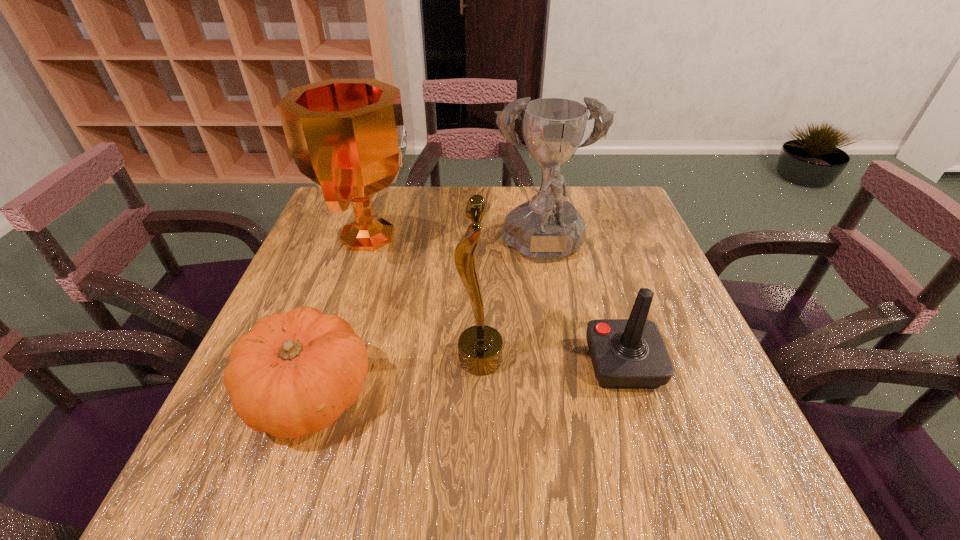
The image size is (960, 540). In order to click on vacant space that satisfies the following two spatial constraints: 1. on the back side of the fourth tallest object; 2. on the side of the leftmost award with the star emblem in this screenshot , I will do `click(584, 236)`.

The image size is (960, 540). Find the location of `vacant area in the image that satisfies the following two spatial constraints: 1. on the side of the joystick with the star emblem; 2. on the left side of the leftmost award`. vacant area in the image that satisfies the following two spatial constraints: 1. on the side of the joystick with the star emblem; 2. on the left side of the leftmost award is located at coordinates (328, 364).

Locate an element on the screen. The height and width of the screenshot is (540, 960). free region that satisfies the following two spatial constraints: 1. on the front-facing side of the fourth tallest object; 2. on the right side of the nearest award is located at coordinates pyautogui.click(x=480, y=364).

Where is `vacant area that satisfies the following two spatial constraints: 1. on the front-facing side of the nearest award; 2. on the left side of the second shortest object`? This screenshot has height=540, width=960. vacant area that satisfies the following two spatial constraints: 1. on the front-facing side of the nearest award; 2. on the left side of the second shortest object is located at coordinates (480, 364).